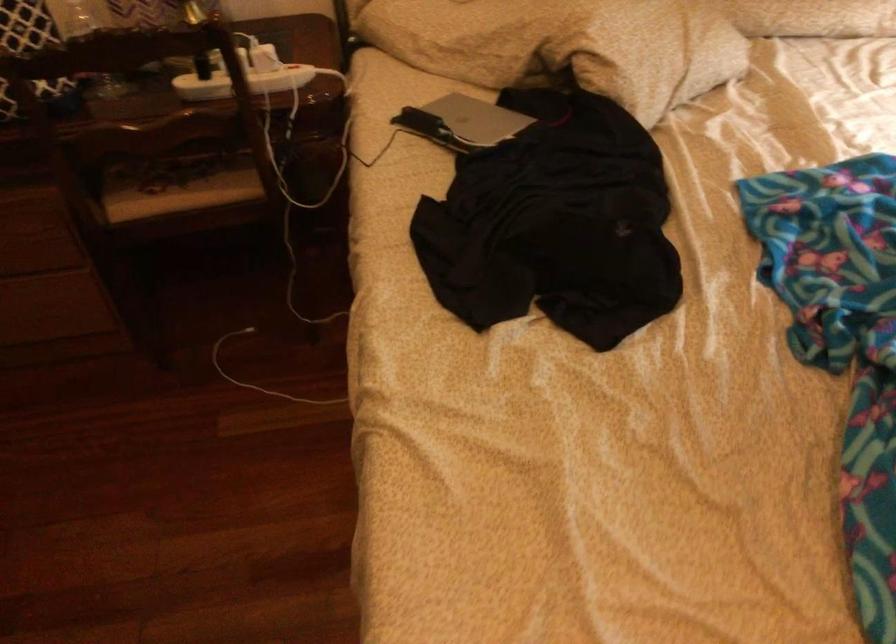
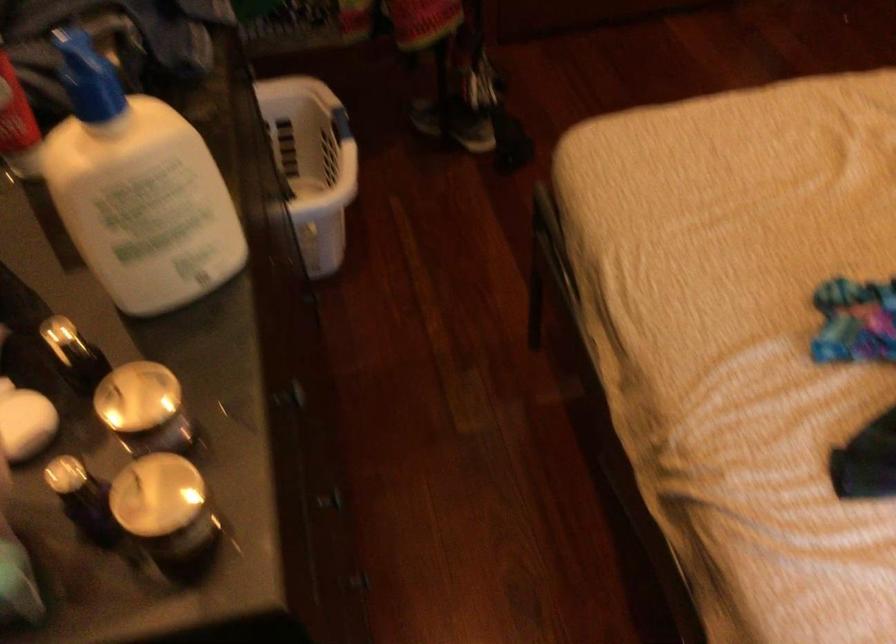
The images are taken continuously from a first-person perspective. In which direction is your viewpoint rotating?

The camera's rotation is toward left-down.